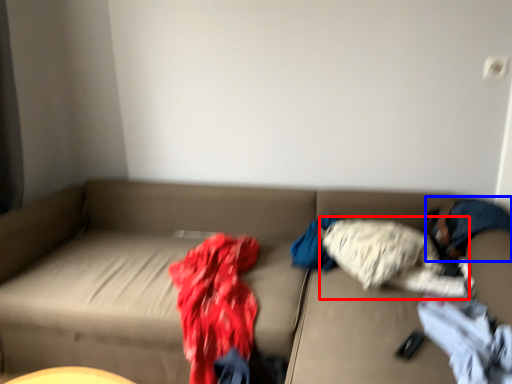
Question: Which point is closer to the camera, clothing (highlighted by a red box) or person (highlighted by a blue box)?

Choices:
 (A) clothing
 (B) person

Answer: (B)